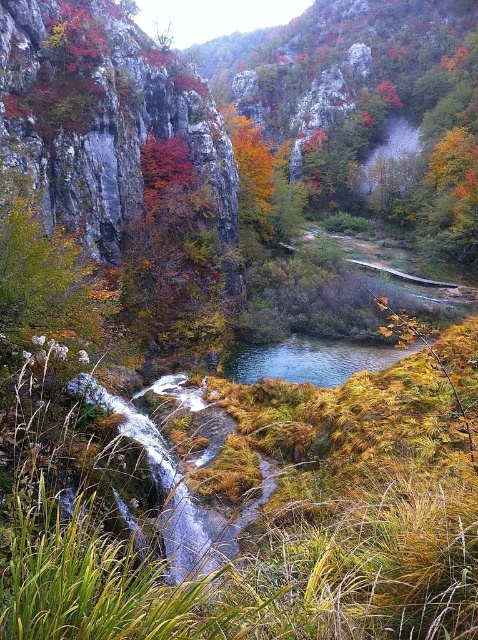
Find the location of a particular element. Image resolution: width=478 pixels, height=640 pixels. autumn leaves at center is located at coordinates (173, 262).

The height and width of the screenshot is (640, 478). In order to click on autumn leaves at center in this screenshot , I will do `click(173, 262)`.

Which is more to the right, rustic stone cliff at center or autumn leaves at center?

autumn leaves at center

Who is more forward, (137, 172) or (173, 252)?

Point (137, 172)

The height and width of the screenshot is (640, 478). I want to click on rustic stone cliff at center, so click(x=113, y=132).

Is point (110, 154) positioned before point (319, 381)?

Yes, it is.

You are a GUI agent. You are given a task and a screenshot of the screen. Output one action in this format:
    pyautogui.click(x=<x>, y=<y>)
    Task: Click on the rustic stone cliff at center
    
    Given the screenshot: What is the action you would take?
    pyautogui.click(x=113, y=132)

Find the location of `rustic stone cliff at center`. rustic stone cliff at center is located at coordinates (113, 132).